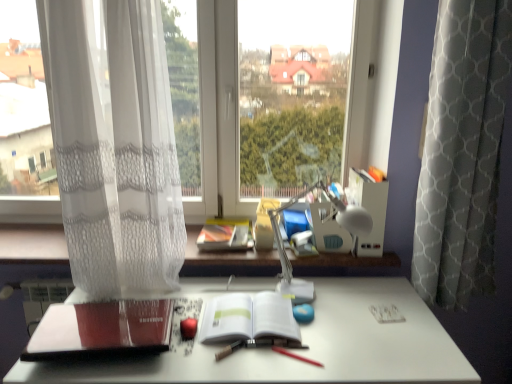
Locate an element on the screen. vacant space in between white plastic table lamp at center and white paper at center, placed as the 1th paperback book when sorted from right to left is located at coordinates (321, 323).